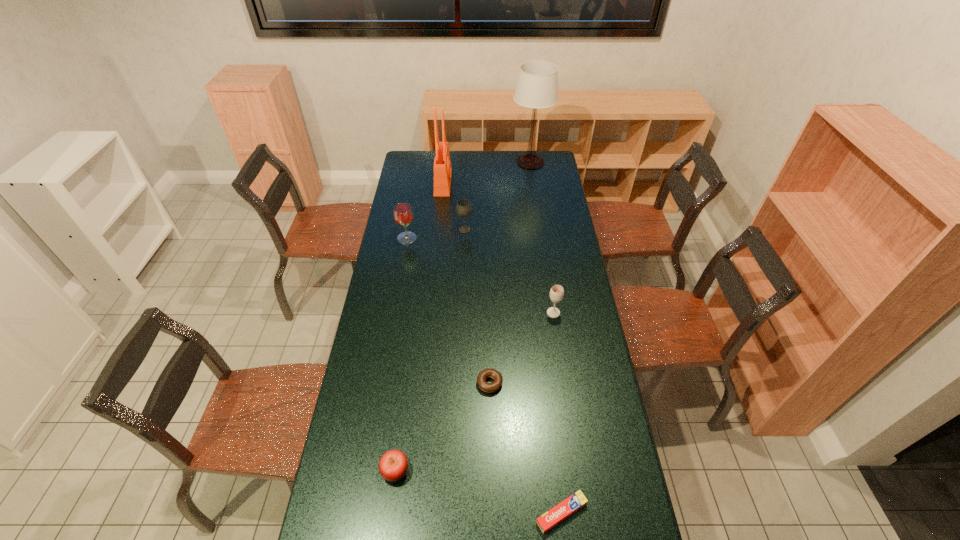
The image size is (960, 540). Identify the location of empty space between the leftmost wineglass and the seventh shortest object. (425, 211).

Find the location of a particular element. The image size is (960, 540). vacant space that is in between the leftmost wineglass and the fifth farthest object is located at coordinates (480, 275).

Locate an element on the screen. The image size is (960, 540). free space between the doughnut and the fourth object from left to right is located at coordinates (477, 306).

Find the location of a particular element. free space between the nearest wineglass and the tote bag is located at coordinates (498, 248).

Choose which object is the sixth nearest neighbor to the leftmost wineglass. Please provide its 2D coordinates. Your answer should be formatted as a tuple, i.e. [(x, y)], where the tuple contains the x and y coordinates of a point satisfying the conditions above.

[(393, 465)]

Point out which object is positioned as the fourth nearest to the second tallest object. Please provide its 2D coordinates. Your answer should be formatted as a tuple, i.e. [(x, y)], where the tuple contains the x and y coordinates of a point satisfying the conditions above.

[(557, 292)]

Point out which wineglass is positioned as the nearest to the tallest object. Please provide its 2D coordinates. Your answer should be formatted as a tuple, i.e. [(x, y)], where the tuple contains the x and y coordinates of a point satisfying the conditions above.

[(463, 208)]

Where is `the closest wineglass to the second wineglass from right to left`? the closest wineglass to the second wineglass from right to left is located at coordinates [x=403, y=215].

Where is `vacant point that satisfies the following two spatial constraints: 1. on the back side of the apple; 2. on the left side of the second wineglass from left to right`? This screenshot has height=540, width=960. vacant point that satisfies the following two spatial constraints: 1. on the back side of the apple; 2. on the left side of the second wineglass from left to right is located at coordinates (427, 230).

Locate an element on the screen. The height and width of the screenshot is (540, 960). vacant space that satisfies the following two spatial constraints: 1. above the cylindrical shade of the tallest object; 2. on the front side of the fourth object from right to left is located at coordinates (563, 383).